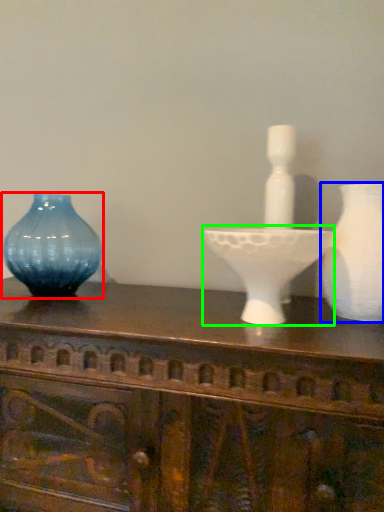
Question: Which object is the closest to the vase (highlighted by a red box)? Choose among these: vase (highlighted by a blue box) or candle holder (highlighted by a green box).

Choices:
 (A) vase
 (B) candle holder

Answer: (B)